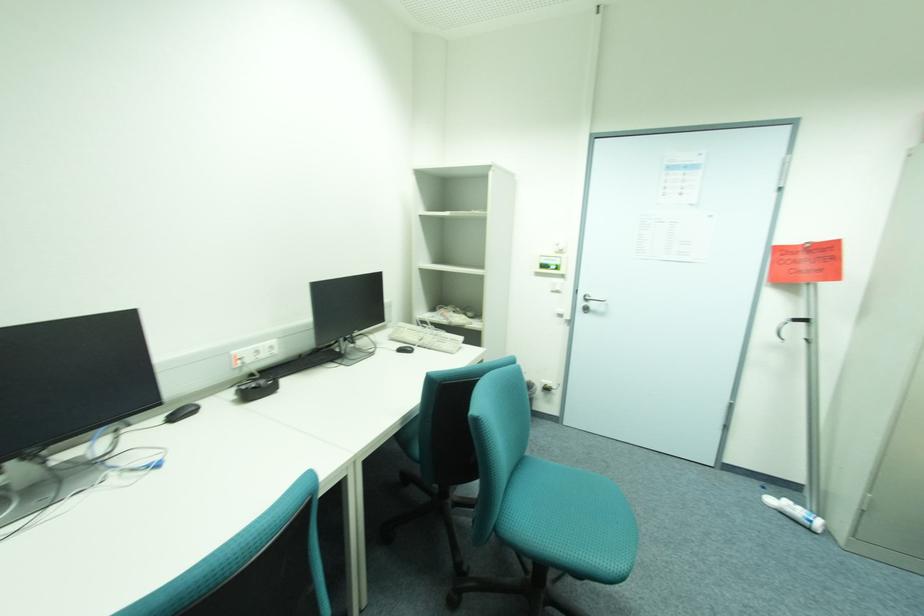
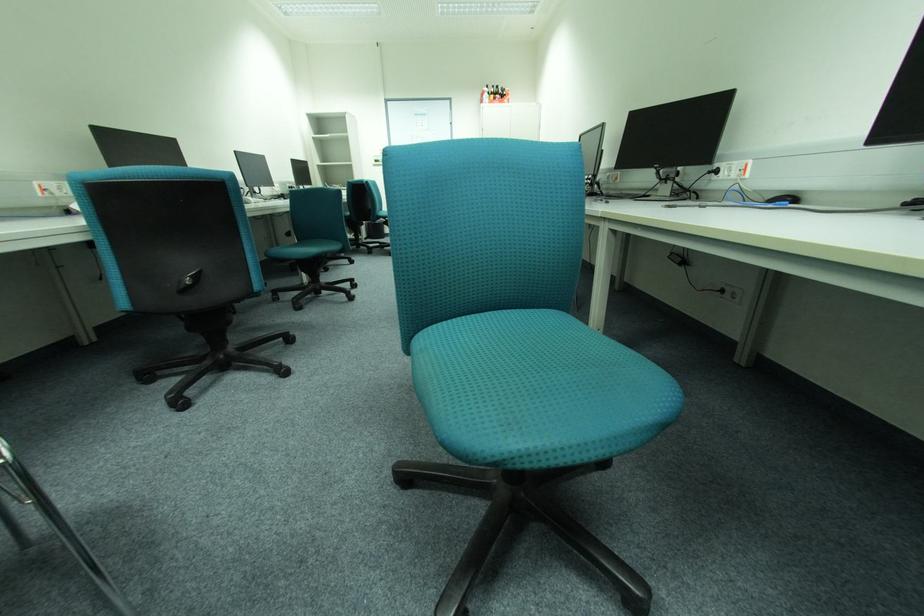
Question: The images are taken continuously from a first-person perspective. In which direction are you moving?

Choices:
 (A) Left
 (B) Right
 (C) Forward
 (D) Backward

Answer: (D)